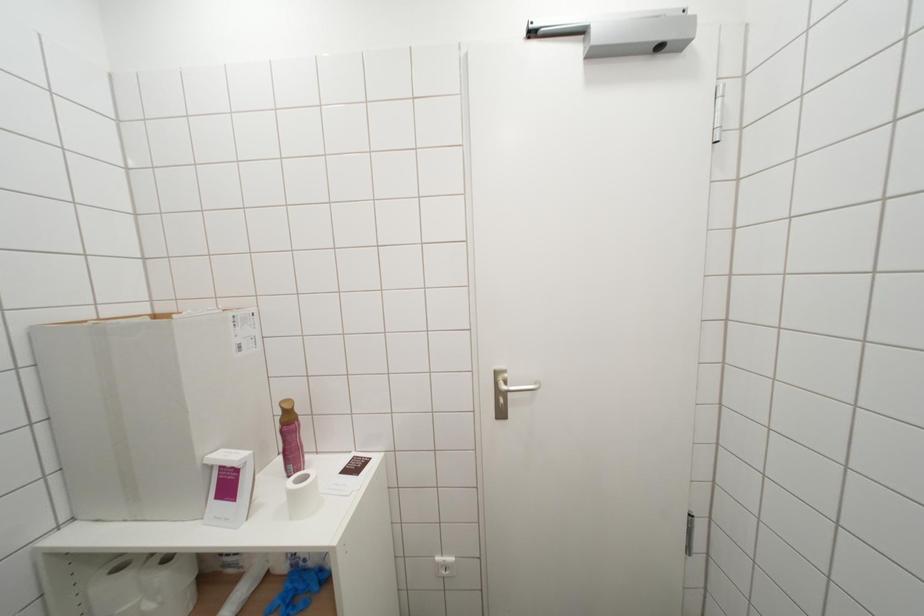
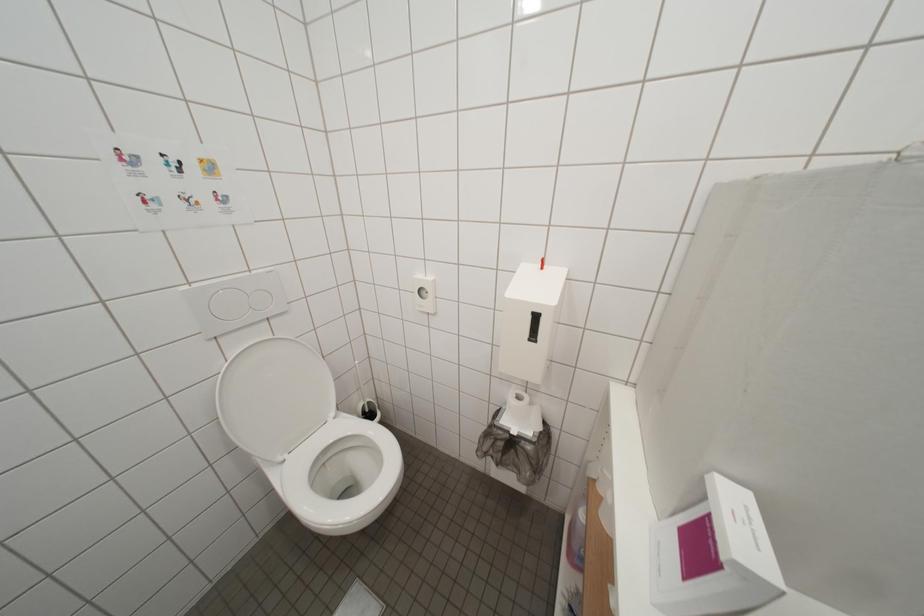
The first image is from the beginning of the video and the second image is from the end. How did the camera likely rotate when shooting the video?

The rotation direction of the camera is left-down.